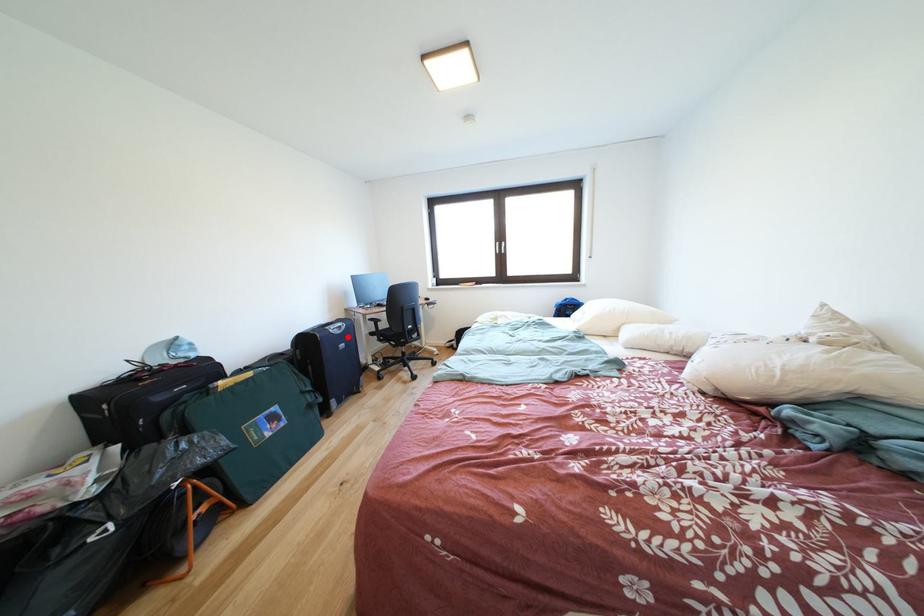
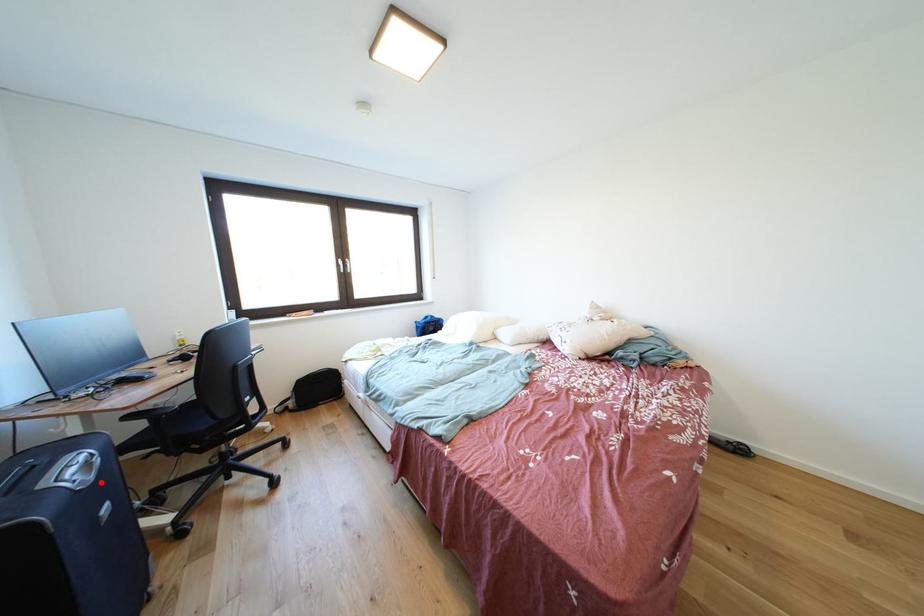
I am providing you with two images of the same scene from different viewpoints. A red point is marked on the first image and another point is marked on the second image. Are the points marked in image1 and image2 representing the same 3D position?

Yes